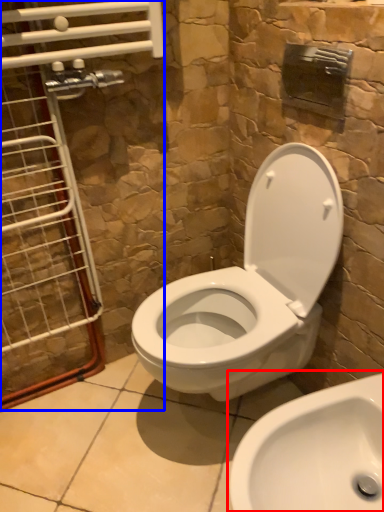
Question: Which point is closer to the camera, sink (highlighted by a red box) or glass door (highlighted by a blue box)?

Choices:
 (A) sink
 (B) glass door

Answer: (A)